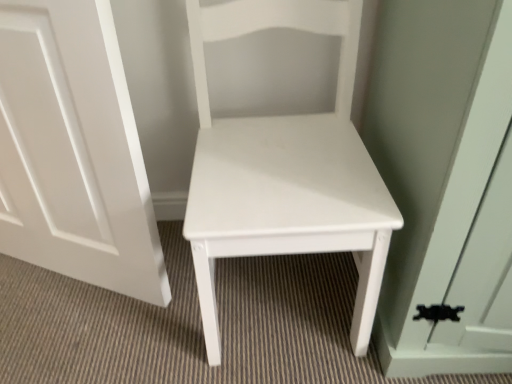
Question: Considering their positions, is white matte chair at center located in front of or behind white matte door at center?

Choices:
 (A) behind
 (B) front

Answer: (B)

Question: In terms of width, does white matte chair at center look wider or thinner when compared to white matte door at center?

Choices:
 (A) thin
 (B) wide

Answer: (B)

Question: Is white matte chair at center inside or outside of white matte door at center?

Choices:
 (A) outside
 (B) inside

Answer: (A)

Question: Based on their positions, is white matte door at center located to the left or right of white matte chair at center?

Choices:
 (A) right
 (B) left

Answer: (B)

Question: Is white matte door at center bigger or smaller than white matte chair at center?

Choices:
 (A) big
 (B) small

Answer: (B)

Question: In terms of width, does white matte door at center look wider or thinner when compared to white matte chair at center?

Choices:
 (A) wide
 (B) thin

Answer: (B)

Question: From a real-world perspective, is white matte door at center above or below white matte chair at center?

Choices:
 (A) above
 (B) below

Answer: (B)